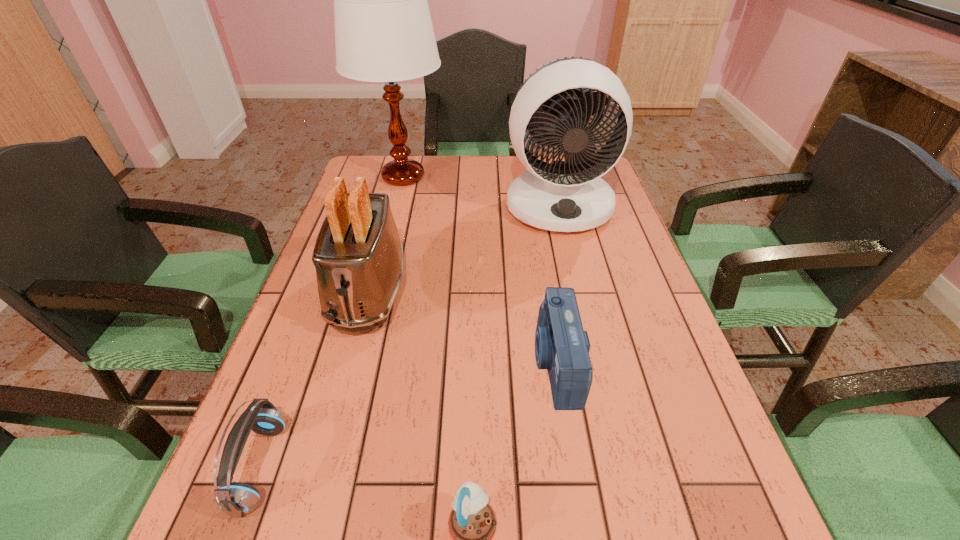
I want to click on the tallest object, so click(x=383, y=29).

You are a GUI agent. You are given a task and a screenshot of the screen. Output one action in this format:
    pyautogui.click(x=<x>, y=<y>)
    Task: Click on the second tallest object
    Image resolution: width=960 pixels, height=540 pixels.
    Given the screenshot: What is the action you would take?
    pyautogui.click(x=566, y=196)

I want to click on toaster, so click(358, 256).

At what (x,y) coordinates should I click in order to perform the action: click on camera. Please return your answer as a coordinate pair (x, y). The width and height of the screenshot is (960, 540). Looking at the image, I should click on (562, 347).

Identify the location of headset. The image size is (960, 540). (236, 499).

Find the location of a particular element. Image resolution: width=960 pixels, height=540 pixels. free location located 0.140m on the front of the table lamp is located at coordinates (391, 227).

Identify the location of free space located on the grille of the fan. The height and width of the screenshot is (540, 960). (585, 314).

Image resolution: width=960 pixels, height=540 pixels. In order to click on vacant space situated 0.250m on the side of the toaster with the control lever in this screenshot , I will do `click(324, 456)`.

At what (x,y) coordinates should I click in order to perform the action: click on free location located 0.260m on the lens of the camera. Please return your answer as a coordinate pair (x, y). Image resolution: width=960 pixels, height=540 pixels. Looking at the image, I should click on (408, 363).

You are a GUI agent. You are given a task and a screenshot of the screen. Output one action in this format:
    pyautogui.click(x=<x>, y=<y>)
    Task: Click on the vacant space situated on the lens of the camera
    
    Given the screenshot: What is the action you would take?
    pyautogui.click(x=370, y=363)